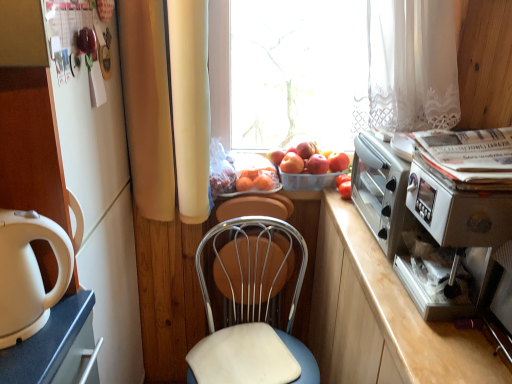
Measure the distance between point (305,151) and camera.

Point (305,151) and camera are 1.67 meters apart.

This screenshot has width=512, height=384. Describe the element at coordinates (256, 207) in the screenshot. I see `metallic silver swivel chair at center` at that location.

What do you see at coordinates (430, 229) in the screenshot?
I see `metallic silver toaster oven at right` at bounding box center [430, 229].

What do you see at coordinates (317, 164) in the screenshot? The width and height of the screenshot is (512, 384). I see `red matte apple at center, positioned as the second apple in right-to-left order` at bounding box center [317, 164].

Where is `red matte apple at center, the 3th apple in the left-to-right sequence`? red matte apple at center, the 3th apple in the left-to-right sequence is located at coordinates [x=317, y=164].

The height and width of the screenshot is (384, 512). What do you see at coordinates (338, 161) in the screenshot?
I see `red matte apple at upper right, placed as the 1th apple when sorted from right to left` at bounding box center [338, 161].

The image size is (512, 384). Find the location of `red matte apple at center, the second apple when ordered from left to right`. red matte apple at center, the second apple when ordered from left to right is located at coordinates (306, 149).

Is orange matte at center positioned beyond the bounds of red matte apple at upper right, which is counted as the 4th apple, starting from the left?

orange matte at center lies outside red matte apple at upper right, which is counted as the 4th apple, starting from the left,'s area.

Which object is more forward, orange matte at center or red matte apple at upper right, placed as the 1th apple when sorted from right to left?

orange matte at center is closer to the camera.

From a real-world perspective, is orange matte at center under red matte apple at upper right, which is counted as the 4th apple, starting from the left?

Yes, from a real-world perspective, orange matte at center is under red matte apple at upper right, which is counted as the 4th apple, starting from the left.

Between point (262, 177) and point (332, 157), which one is positioned in front?

Positioned in front is point (262, 177).

Could you tell me if red matte apple at upper right, placed as the 1th apple when sorted from right to left, is facing red matte tomato at center?

Yes, red matte apple at upper right, placed as the 1th apple when sorted from right to left, is aimed at red matte tomato at center.

Who is bigger, red matte apple at upper right, which is counted as the 4th apple, starting from the left, or red matte tomato at center?

With larger size is red matte apple at upper right, which is counted as the 4th apple, starting from the left.

Considering the relative positions of red matte apple at upper right, placed as the 1th apple when sorted from right to left, and red matte tomato at center in the image provided, is red matte apple at upper right, placed as the 1th apple when sorted from right to left, to the right of red matte tomato at center from the viewer's perspective?

Yes.

How different are the orientations of red matte apple at upper right, which is counted as the 4th apple, starting from the left, and red matte tomato at center in degrees?

The facing directions of red matte apple at upper right, which is counted as the 4th apple, starting from the left, and red matte tomato at center are 0.000499 degrees apart.

At what (x,y) coordinates should I click in order to perform the action: click on appliance in front of the red matte tomato at center. Please return your answer as a coordinate pair (x, y). The height and width of the screenshot is (384, 512). Looking at the image, I should click on (430, 229).

Is red matte tomato at center oriented away from metallic silver toaster oven at right?

No.

From the image's perspective, is red matte tomato at center under metallic silver toaster oven at right?

Incorrect, from the image's perspective, red matte tomato at center is higher than metallic silver toaster oven at right.

From a real-world perspective, is white glossy cabinet at left under orange matte at center?

Yes, from a real-world perspective, white glossy cabinet at left is under orange matte at center.

Would you say white glossy cabinet at left is inside or outside orange matte at center?

white glossy cabinet at left exists outside the volume of orange matte at center.

Considering the relative positions of white glossy cabinet at left and orange matte at center in the image provided, is white glossy cabinet at left in front of orange matte at center?

That is True.

What's the angular difference between white glossy cabinet at left and orange matte at center's facing directions?

white glossy cabinet at left and orange matte at center are facing 94.5 degrees away from each other.

Is red matte apple at center, the 3th apple in the left-to-right sequence, touching metallic silver toaster oven at right?

red matte apple at center, the 3th apple in the left-to-right sequence, and metallic silver toaster oven at right are not in contact.

Is red matte apple at center, the 3th apple in the left-to-right sequence, bigger than metallic silver toaster oven at right?

Incorrect, red matte apple at center, the 3th apple in the left-to-right sequence, is not larger than metallic silver toaster oven at right.

Looking at this image, how distant is red matte apple at center, the 3th apple in the left-to-right sequence, from metallic silver toaster oven at right?

red matte apple at center, the 3th apple in the left-to-right sequence, and metallic silver toaster oven at right are 56.97 centimeters apart.

In the scene shown: Which of these two, white glossy cabinet at left or white glossy kettle at left, is thinner?

Thinner between the two is white glossy kettle at left.

Is white glossy cabinet at left next to white glossy kettle at left and touching it?

white glossy cabinet at left and white glossy kettle at left are not in contact.

From a real-world perspective, which is physically below, white glossy cabinet at left or white glossy kettle at left?

In real-world perspective, white glossy cabinet at left is lower.

Based on the photo, does orange matte at center have a greater width compared to red matte apple at center, the 3th apple in the left-to-right sequence?

Indeed, orange matte at center has a greater width compared to red matte apple at center, the 3th apple in the left-to-right sequence.

Where is `the 2nd apple located above the orange matte at center (from a real-world perspective)`? The image size is (512, 384). the 2nd apple located above the orange matte at center (from a real-world perspective) is located at coordinates [317, 164].

Does point (262, 178) lie in front of point (310, 173)?

Yes, it is in front of point (310, 173).

Is orange matte at center placed right next to red matte apple at center, the 3th apple in the left-to-right sequence?

No, orange matte at center is not making contact with red matte apple at center, the 3th apple in the left-to-right sequence.

Where is `apple that is the 4th object located behind the orange matte at center`? The image size is (512, 384). apple that is the 4th object located behind the orange matte at center is located at coordinates (338, 161).

Where is `food in front of the red matte apple at upper right, placed as the 1th apple when sorted from right to left`? The width and height of the screenshot is (512, 384). food in front of the red matte apple at upper right, placed as the 1th apple when sorted from right to left is located at coordinates point(345,190).

Estimate the real-world distances between objects in this image. Which object is closer to metallic blue chair at center, red matte apple at center, the 3th apple in the left-to-right sequence, or orange matte at center?

orange matte at center is positioned closer to the anchor metallic blue chair at center.

In the scene shown: When comparing their distances from metallic blue chair at center, does red matte tomato at center or transparent glass window at center seem further?

Among the two, transparent glass window at center is located further to metallic blue chair at center.

Which object lies nearer to the anchor point white glossy cabinet at left, metallic silver toaster oven at right or transparent glass window at center?

Among the two, transparent glass window at center is located nearer to white glossy cabinet at left.

Considering their positions, is orange matte at center positioned closer to white glossy kettle at left than transparent glass window at center?

Among the two, orange matte at center is located nearer to white glossy kettle at left.

Considering their positions, is red matte apple at center, the 3th apple in the left-to-right sequence, positioned further to metallic silver swivel chair at center than red matte tomato at center?

red matte tomato at center.

From the picture: From the image, which object appears to be farther from red matte apple at center, positioned as the second apple in right-to-left order, metallic silver swivel chair at center or smooth peach at center, which is the 4th apple in right-to-left order?

The object further to red matte apple at center, positioned as the second apple in right-to-left order, is metallic silver swivel chair at center.

Estimate the real-world distances between objects in this image. Which object is closer to transparent glass window at center, white glossy kettle at left or metallic blue chair at center?

metallic blue chair at center is closer to transparent glass window at center.

Which object lies further to the anchor point metallic blue chair at center, red matte apple at center, placed as the 3th apple when sorted from right to left, or smooth peach at center, which is the 4th apple in right-to-left order?

Among the two, red matte apple at center, placed as the 3th apple when sorted from right to left, is located further to metallic blue chair at center.

What are the coordinates of `fruit between white glossy cabinet at left and metallic silver toaster oven at right from left to right` in the screenshot? It's located at (256, 179).

This screenshot has width=512, height=384. What are the coordinates of `fruit positioned between metallic blue chair at center and red matte apple at upper right, which is counted as the 4th apple, starting from the left, from near to far` in the screenshot? It's located at (256, 179).

This screenshot has height=384, width=512. I want to click on chair between metallic silver toaster oven at right and smooth peach at center, acting as the 1th apple starting from the left, in the front-back direction, so click(251, 307).

At what (x,y) coordinates should I click in order to perform the action: click on chair between metallic silver toaster oven at right and red matte apple at upper right, placed as the 1th apple when sorted from right to left, from front to back. Please return your answer as a coordinate pair (x, y). Looking at the image, I should click on coord(251,307).